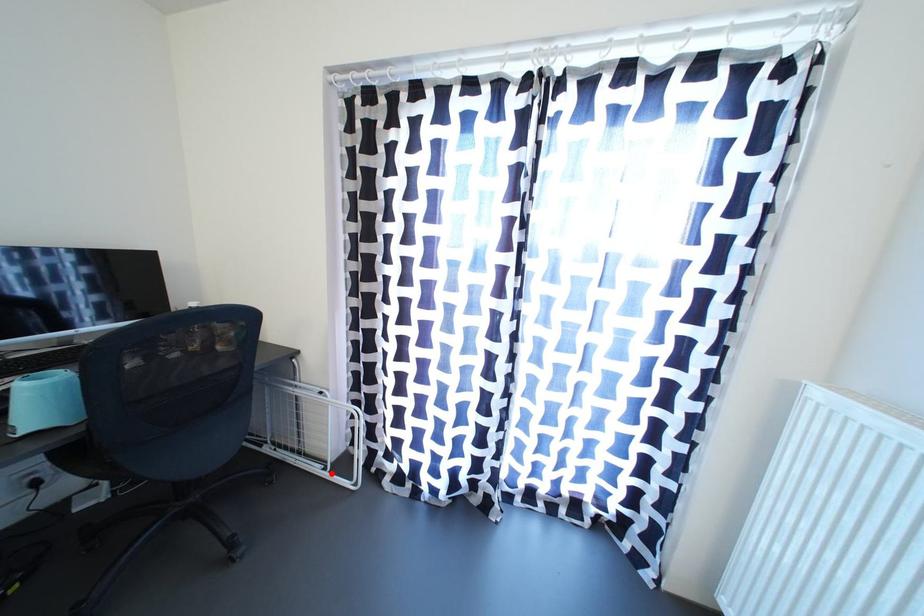
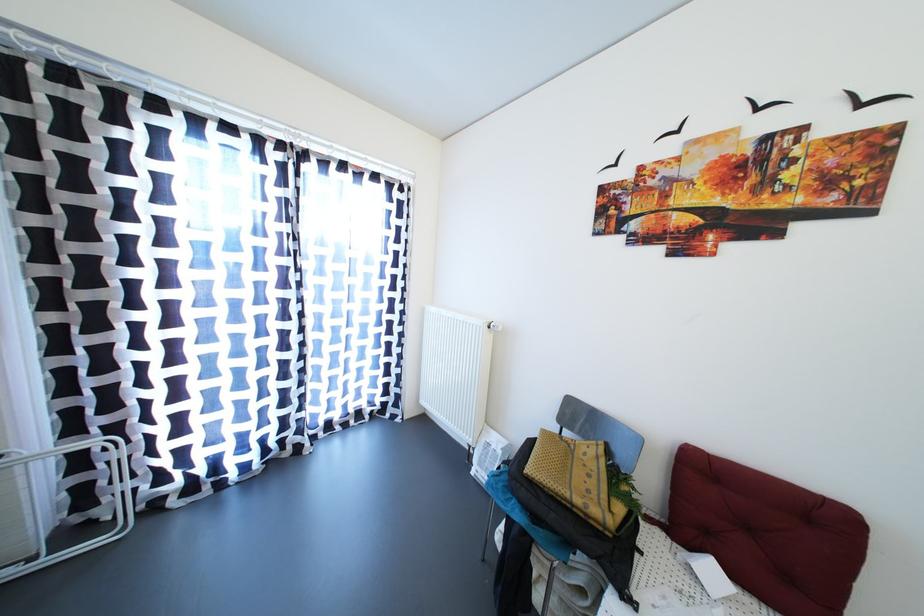
The point at the highlighted location is marked in the first image. Where is the corresponding point in the second image?

(39, 564)